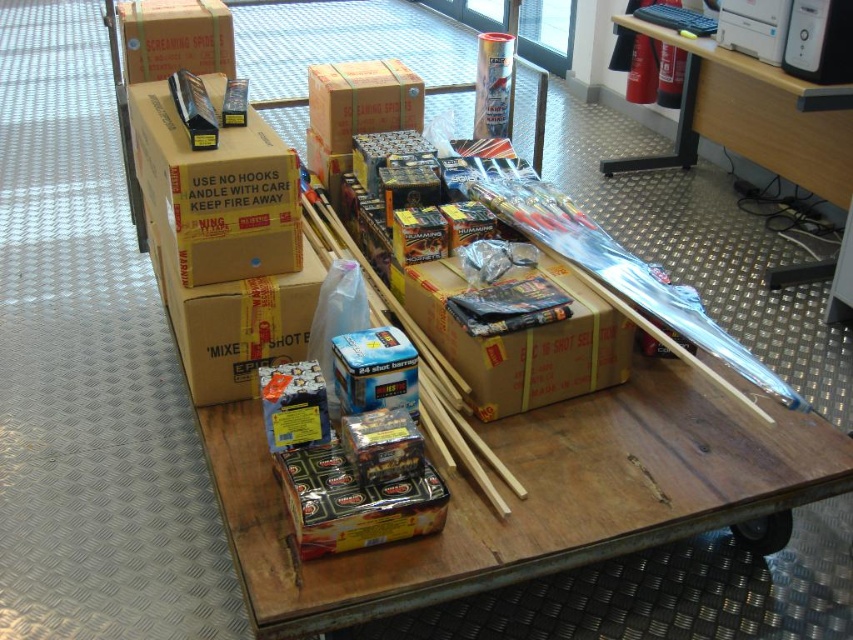
You are a warehouse worker who needs to retrieve an item from the trolley. You see two points marked on the floor near the trolley. The first point is at coordinate point (292, 269) and the second is at point (524, 403). According to the warehouse layout, which point is closer to the entrance of the warehouse?

Point (292, 269) is behind point (524, 403), so the point closer to the entrance would be point (524, 403) since it is in front of the other point.

You are a warehouse worker who needs to move the brown cardboard box at center and the matte cardboard box at upper left to a different storage area. The path to the storage area is 1.2 meters wide. Can both boxes be moved through the path without needing to rearrange them?

The distance between the brown cardboard box at center and the matte cardboard box at upper left is 1.06 meters. Since the path is 1.2 meters wide, which is wider than the distance between them, both boxes can be moved through the path without needing to rearrange them.

You are a warehouse worker who needs to move the brown cardboard box at upper left and the matte cardboard box at upper left from the trolley. Since the two boxes are very close to each other, you want to know if you can slide them apart without disturbing the other boxes on the trolley. Can you separate them easily?

The brown cardboard box at upper left is 15.63 inches from the matte cardboard box at upper left. Since there is a gap between them, you can slide them apart without disturbing the other boxes on the trolley.